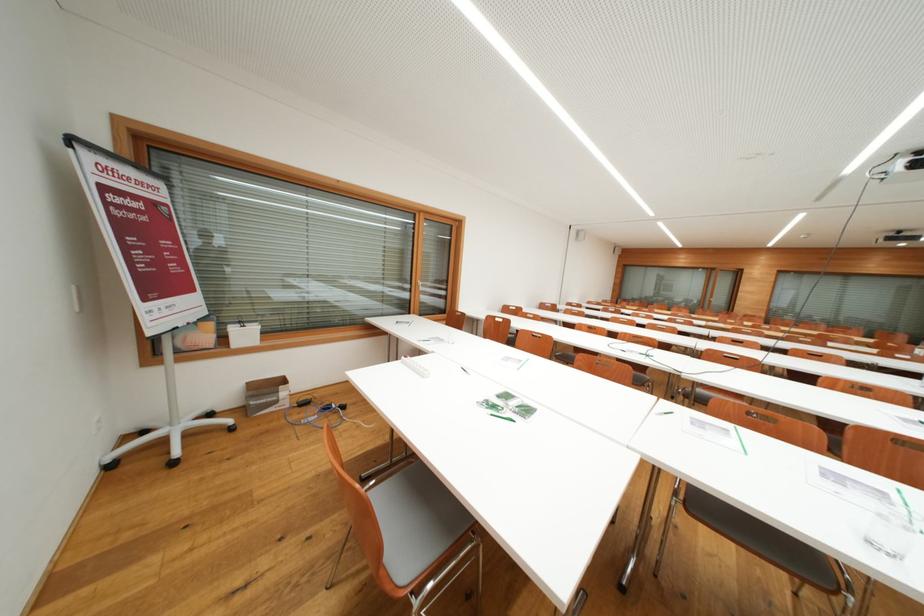
Find where to lift the drinking glass. Please return your answer as a coordinate pair (x, y).

(891, 532)